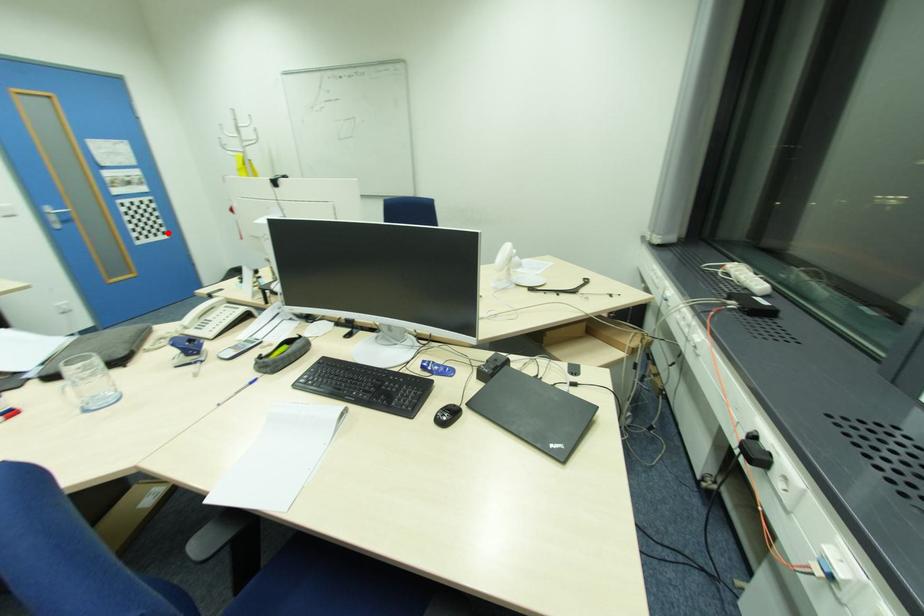
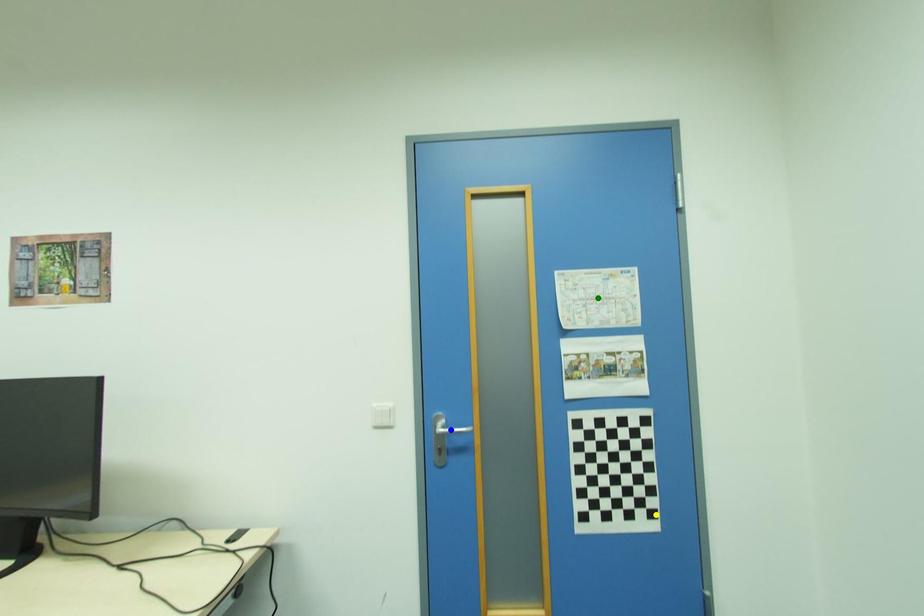
Question: I am providing you with two images of the same scene from different viewpoints. A red point is marked on the first image. You are given multiple points on the second image. Can you choose the point in image 2 that corresponds to the point in image 1?

Choices:
 (A) yellow point
 (B) blue point
 (C) green point

Answer: (A)